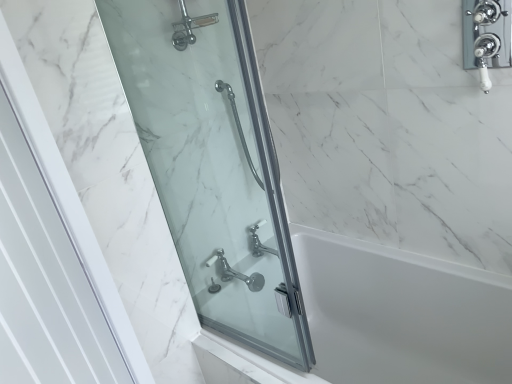
Question: Considering their positions, is white glossy door at left, which is the first screen door from front to back, located in front of or behind polished chrome faucet at lower center?

Choices:
 (A) behind
 (B) front

Answer: (B)

Question: Considering the positions of white glossy door at left, which is counted as the second screen door, starting from the back, and polished chrome faucet at lower center in the image, is white glossy door at left, which is counted as the second screen door, starting from the back, wider or thinner than polished chrome faucet at lower center?

Choices:
 (A) wide
 (B) thin

Answer: (B)

Question: Estimate the real-world distances between objects in this image. Which object is farther from the polished chrome faucet at lower center?

Choices:
 (A) clear glass shower door at left, the 1th screen door from the back
 (B) white glossy door at left, which is counted as the second screen door, starting from the back
 (C) white glossy bathtub at center

Answer: (B)

Question: Which object is the closest to the white glossy door at left, which is the first screen door from front to back?

Choices:
 (A) white glossy bathtub at center
 (B) clear glass shower door at left, the 1th screen door from the back
 (C) polished chrome faucet at lower center

Answer: (B)